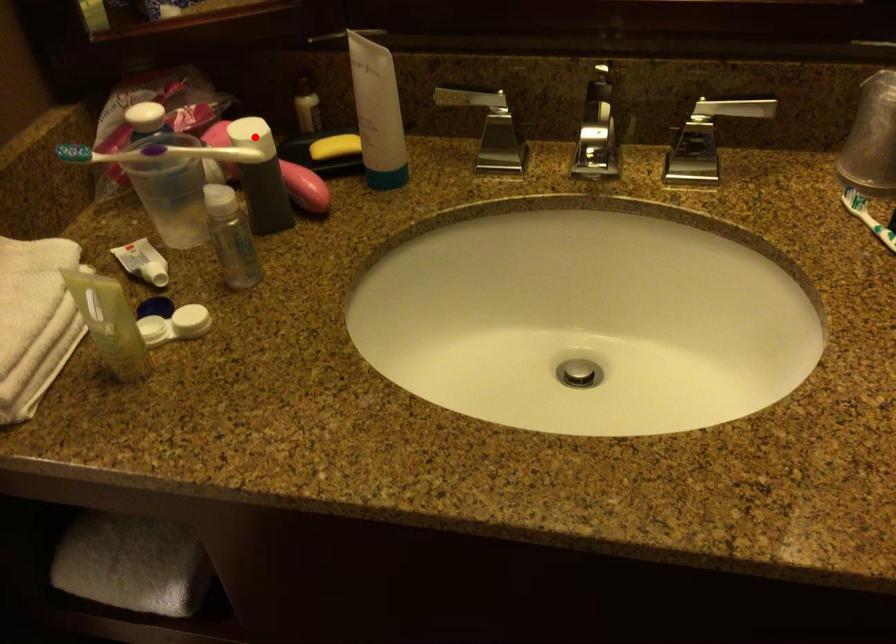
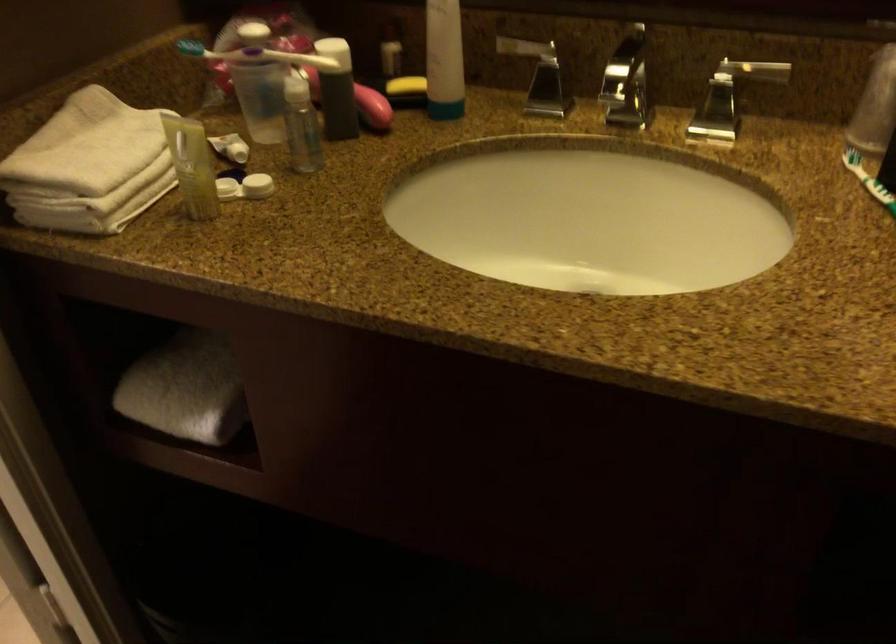
Question: I am providing you with two images of the same scene from different viewpoints. A red point is shown in image1. For the corresponding object point in image2, is it positioned nearer or farther from the camera?

Choices:
 (A) Nearer
 (B) Farther

Answer: (B)